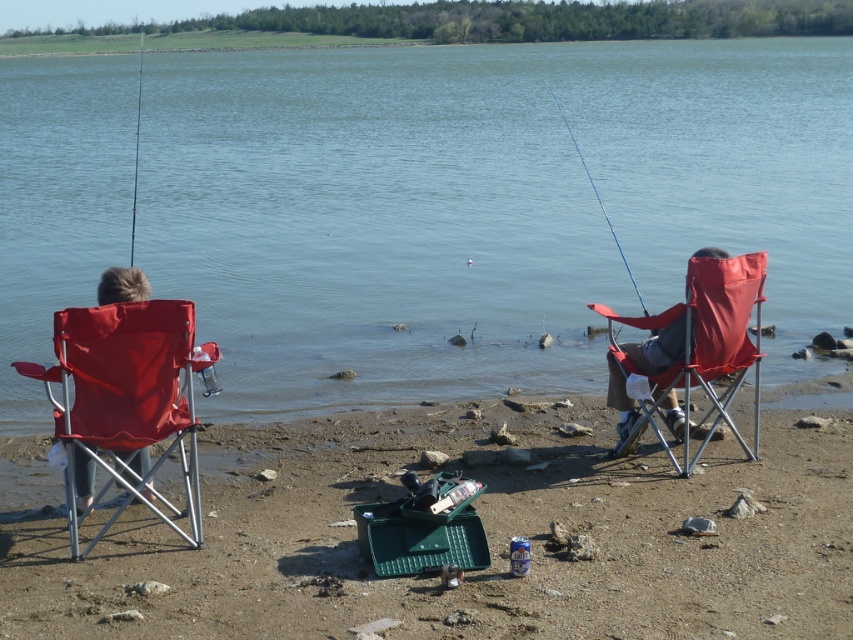
Question: Where is smooth sand shoreline at lower center located in relation to matte plastic beach chair at left in the image?

Choices:
 (A) above
 (B) below

Answer: (B)

Question: Which point appears farthest from the camera in this image?

Choices:
 (A) (138, 90)
 (B) (125, 454)

Answer: (A)

Question: Which of the following is the farthest from the observer?

Choices:
 (A) coord(729,266)
 (B) coord(93,419)

Answer: (A)

Question: Is clear blue water at center to the right of matte red chair at left from the viewer's perspective?

Choices:
 (A) yes
 (B) no

Answer: (A)

Question: Which object is positioned farthest from the clear blue water at center?

Choices:
 (A) smooth sand shoreline at lower center
 (B) matte red folding chair at right

Answer: (A)

Question: Is smooth sand shoreline at lower center smaller than matte red folding chair at right?

Choices:
 (A) yes
 (B) no

Answer: (B)